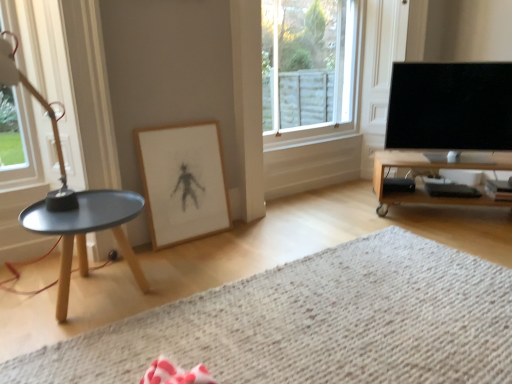
Locate an element on the screen. The image size is (512, 384). spots to the right of matte black tray at left is located at coordinates coord(194,275).